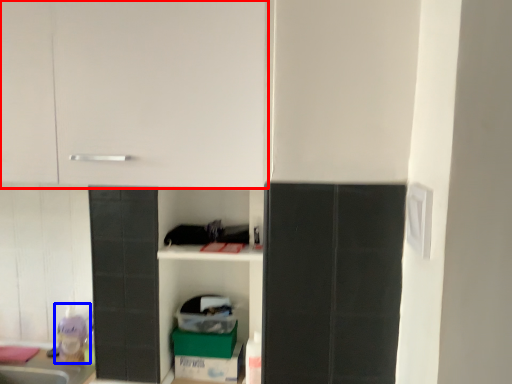
Question: Which point is closer to the camera, cabinetry (highlighted by a red box) or toy (highlighted by a blue box)?

Choices:
 (A) cabinetry
 (B) toy

Answer: (A)